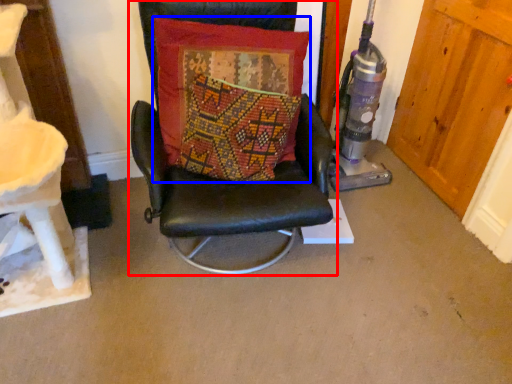
Question: Which object is closer to the camera taking this photo, chair (highlighted by a red box) or pillow (highlighted by a blue box)?

Choices:
 (A) chair
 (B) pillow

Answer: (A)